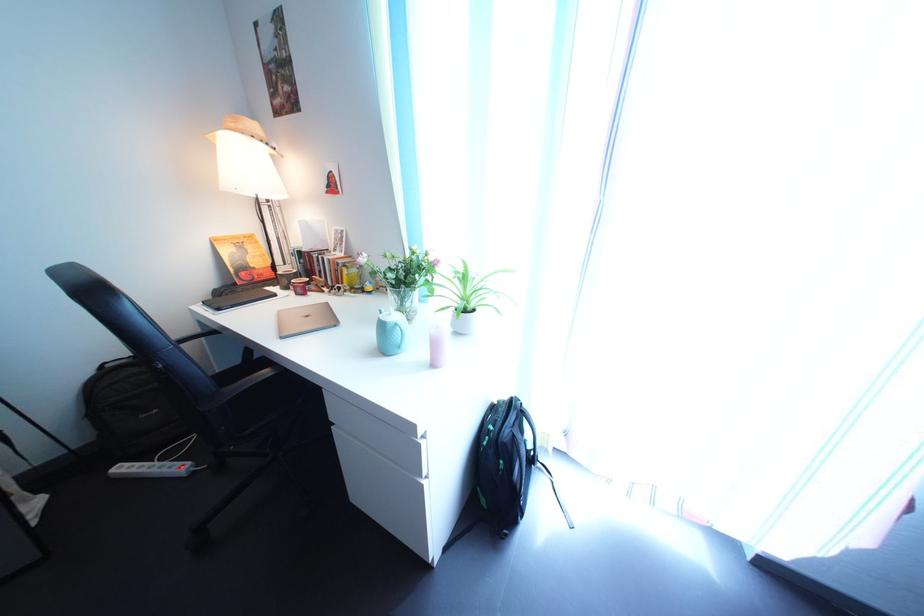
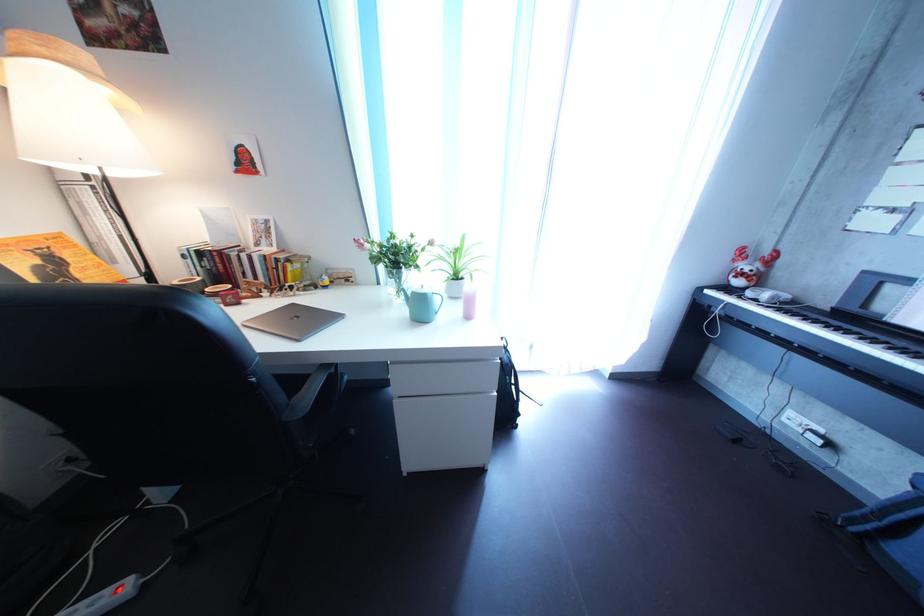
Question: Based on the continuous images, in which direction is the camera rotating? Reply with the corresponding letter.

Choices:
 (A) Left
 (B) Right
 (C) Up
 (D) Down

Answer: (B)